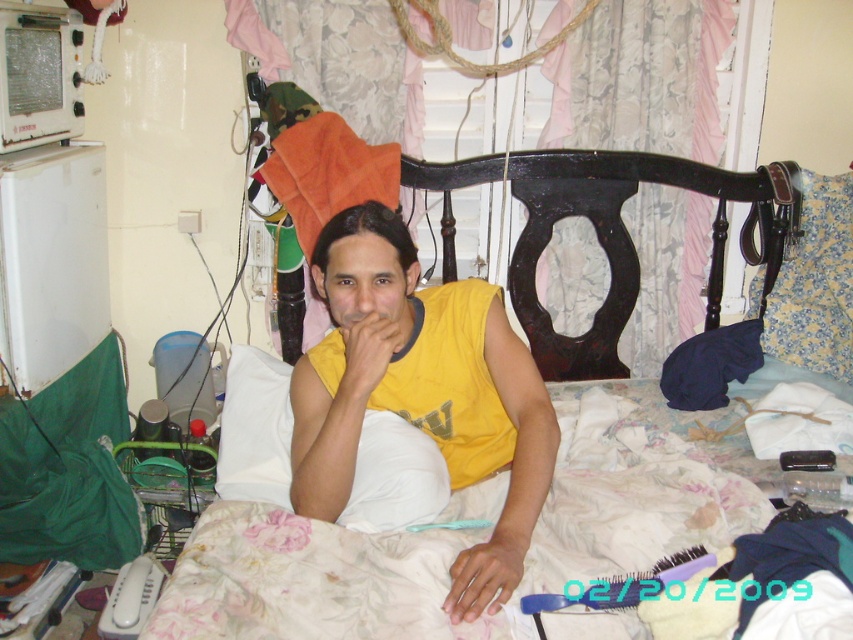
Question: Observing the image, what is the correct spatial positioning of purple plastic brush at lower center in reference to yellow matte hand at center?

Choices:
 (A) above
 (B) below

Answer: (B)

Question: Is dark brown wood headboard at center to the right of smooth skin hand at lower center from the viewer's perspective?

Choices:
 (A) yes
 (B) no

Answer: (A)

Question: Which object is closer to the camera taking this photo?

Choices:
 (A) floral fabric pillow at right
 (B) yellow matte hand at center

Answer: (B)

Question: Considering the real-world distances, which object is closest to the dark brown wood headboard at center?

Choices:
 (A) smooth skin hand at lower center
 (B) white soft pillow at center
 (C) yellow sleeveless shirt at center
 (D) yellow matte hand at center

Answer: (C)

Question: Among these objects, which one is nearest to the camera?

Choices:
 (A) yellow sleeveless shirt at center
 (B) white soft pillow at center
 (C) floral fabric bed at center

Answer: (C)

Question: Is floral fabric bed at center smaller than white soft pillow at center?

Choices:
 (A) yes
 (B) no

Answer: (B)